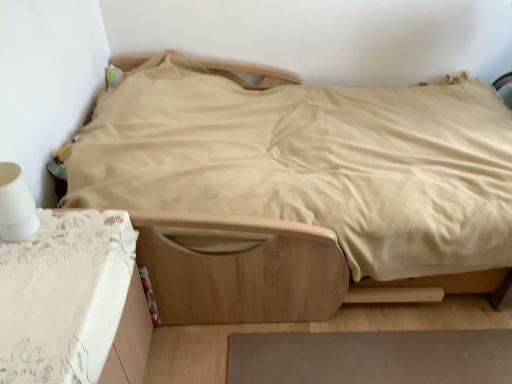
The height and width of the screenshot is (384, 512). What do you see at coordinates (297, 187) in the screenshot? I see `light brown wooden bed at center` at bounding box center [297, 187].

Find the location of a particular element. The image size is (512, 384). light brown wooden bed at center is located at coordinates (297, 187).

What do you see at coordinates (15, 205) in the screenshot?
I see `white matte table lamp at left` at bounding box center [15, 205].

What do you see at coordinates (371, 357) in the screenshot? The width and height of the screenshot is (512, 384). I see `brown matte rug at lower center` at bounding box center [371, 357].

Where is `white lace tablecloth at lower left`? Image resolution: width=512 pixels, height=384 pixels. white lace tablecloth at lower left is located at coordinates (64, 296).

Identify the location of light brown wooden bed at center. This screenshot has width=512, height=384. (297, 187).

Can you confirm if white matte table lamp at left is shorter than brown matte rug at lower center?

Incorrect, the height of white matte table lamp at left does not fall short of that of brown matte rug at lower center.

Measure the distance from white matte table lamp at left to brown matte rug at lower center.

A distance of 3.53 feet exists between white matte table lamp at left and brown matte rug at lower center.

Which is closer to the camera, (4, 232) or (332, 336)?

The point (4, 232) is more forward.

Considering the sizes of brown matte rug at lower center and white matte table lamp at left in the image, is brown matte rug at lower center bigger or smaller than white matte table lamp at left?

Clearly, brown matte rug at lower center is larger in size than white matte table lamp at left.

Is brown matte rug at lower center surrounding white matte table lamp at left?

No, white matte table lamp at left is not surrounded by brown matte rug at lower center.

Is brown matte rug at lower center placed right next to white matte table lamp at left?

No, brown matte rug at lower center is not beside white matte table lamp at left.

From the image's perspective, is brown matte rug at lower center on white matte table lamp at left?

No.

From a real-world perspective, does light brown wooden bed at center stand above white lace tablecloth at lower left?

Yes, from a real-world perspective, light brown wooden bed at center is over white lace tablecloth at lower left

Is white lace tablecloth at lower left a part of light brown wooden bed at center?

No, light brown wooden bed at center does not contain white lace tablecloth at lower left.

In the image, there is a white lace tablecloth at lower left. Where is `bed above it (from the image's perspective)`? The image size is (512, 384). bed above it (from the image's perspective) is located at coordinates (297, 187).

Is point (255, 234) more distant than point (135, 381)?

That is True.

From the image's perspective, which one is positioned lower, white lace tablecloth at lower left or brown matte rug at lower center?

brown matte rug at lower center, from the image's perspective.

Is white lace tablecloth at lower left wider than brown matte rug at lower center?

Incorrect, the width of white lace tablecloth at lower left does not surpass that of brown matte rug at lower center.

Considering the sizes of objects white lace tablecloth at lower left and brown matte rug at lower center in the image provided, who is smaller, white lace tablecloth at lower left or brown matte rug at lower center?

With smaller size is brown matte rug at lower center.

From the image's perspective, is white lace tablecloth at lower left located beneath light brown wooden bed at center?

Indeed, from the image's perspective, white lace tablecloth at lower left is shown beneath light brown wooden bed at center.

Which object is thinner, white lace tablecloth at lower left or light brown wooden bed at center?

With smaller width is white lace tablecloth at lower left.

From the picture: Does white lace tablecloth at lower left appear on the left side of light brown wooden bed at center?

Correct, you'll find white lace tablecloth at lower left to the left of light brown wooden bed at center.

Considering the positions of objects white lace tablecloth at lower left and light brown wooden bed at center in the image provided, who is behind, white lace tablecloth at lower left or light brown wooden bed at center?

Positioned behind is light brown wooden bed at center.

Do you think white lace tablecloth at lower left is within white matte table lamp at left, or outside of it?

white lace tablecloth at lower left is not inside white matte table lamp at left, it's outside.

Is white lace tablecloth at lower left to the right of white matte table lamp at left from the viewer's perspective?

Yes.

Are white lace tablecloth at lower left and white matte table lamp at left beside each other?

No, white lace tablecloth at lower left is not making contact with white matte table lamp at left.

What's the angular difference between white lace tablecloth at lower left and white matte table lamp at left's facing directions?

The angular difference between white lace tablecloth at lower left and white matte table lamp at left is 0.485 degrees.

Which object is positioned more to the left, brown matte rug at lower center or white lace tablecloth at lower left?

From the viewer's perspective, white lace tablecloth at lower left appears more on the left side.

Does brown matte rug at lower center have a larger size compared to white lace tablecloth at lower left?

Actually, brown matte rug at lower center might be smaller than white lace tablecloth at lower left.

From the picture: From the image's perspective, is brown matte rug at lower center on white lace tablecloth at lower left?

Incorrect, from the image's perspective, brown matte rug at lower center is lower than white lace tablecloth at lower left.

This screenshot has height=384, width=512. In order to click on plain behind the white lace tablecloth at lower left in this screenshot , I will do `click(371, 357)`.

This screenshot has height=384, width=512. I want to click on plain on the right of white matte table lamp at left, so click(x=371, y=357).

In the image, there is a white matte table lamp at left. In order to click on plain below it (from a real-world perspective) in this screenshot , I will do `click(371, 357)`.

Looking at the image, which one is located closer to white matte table lamp at left, light brown wooden bed at center or white lace tablecloth at lower left?

white lace tablecloth at lower left lies closer to white matte table lamp at left than the other object.

When comparing their distances from white lace tablecloth at lower left, does brown matte rug at lower center or light brown wooden bed at center seem further?

brown matte rug at lower center.

When comparing their distances from light brown wooden bed at center, does brown matte rug at lower center or white lace tablecloth at lower left seem closer?

Based on the image, brown matte rug at lower center appears to be nearer to light brown wooden bed at center.

When comparing their distances from brown matte rug at lower center, does white lace tablecloth at lower left or light brown wooden bed at center seem further?

The object further to brown matte rug at lower center is white lace tablecloth at lower left.

Considering their positions, is white lace tablecloth at lower left positioned closer to light brown wooden bed at center than brown matte rug at lower center?

The object closer to light brown wooden bed at center is brown matte rug at lower center.

When comparing their distances from brown matte rug at lower center, does white matte table lamp at left or light brown wooden bed at center seem closer?

light brown wooden bed at center is positioned closer to the anchor brown matte rug at lower center.

Based on their spatial positions, is white matte table lamp at left or brown matte rug at lower center further from white lace tablecloth at lower left?

The object further to white lace tablecloth at lower left is brown matte rug at lower center.

Estimate the real-world distances between objects in this image. Which object is closer to white lace tablecloth at lower left, light brown wooden bed at center or brown matte rug at lower center?

Among the two, light brown wooden bed at center is located nearer to white lace tablecloth at lower left.

Find the location of `table located between white matte table lamp at left and brown matte rug at lower center in the left-right direction`. table located between white matte table lamp at left and brown matte rug at lower center in the left-right direction is located at coordinates (64, 296).

I want to click on bed between white lace tablecloth at lower left and brown matte rug at lower center in the horizontal direction, so click(297, 187).

This screenshot has height=384, width=512. Identify the location of bed located between white matte table lamp at left and brown matte rug at lower center in the left-right direction. (297, 187).

The width and height of the screenshot is (512, 384). In order to click on table between white matte table lamp at left and light brown wooden bed at center in the horizontal direction in this screenshot , I will do `click(64, 296)`.